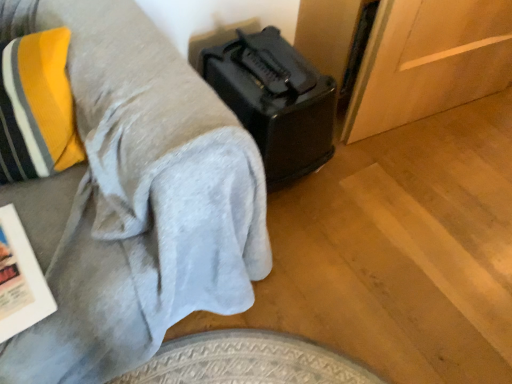
Question: Looking at the image, does black plastic suitcase at lower right seem bigger or smaller compared to white paper magazine at lower left?

Choices:
 (A) big
 (B) small

Answer: (A)

Question: Which is correct: black plastic suitcase at lower right is inside white paper magazine at lower left, or outside of it?

Choices:
 (A) outside
 (B) inside

Answer: (A)

Question: Based on their relative distances, which object is farther from the white paper magazine at lower left?

Choices:
 (A) black plastic toaster at upper right
 (B) black plastic suitcase at lower right

Answer: (B)

Question: Considering the real-world distances, which object is farthest from the white paper magazine at lower left?

Choices:
 (A) black plastic suitcase at lower right
 (B) black plastic toaster at upper right

Answer: (A)